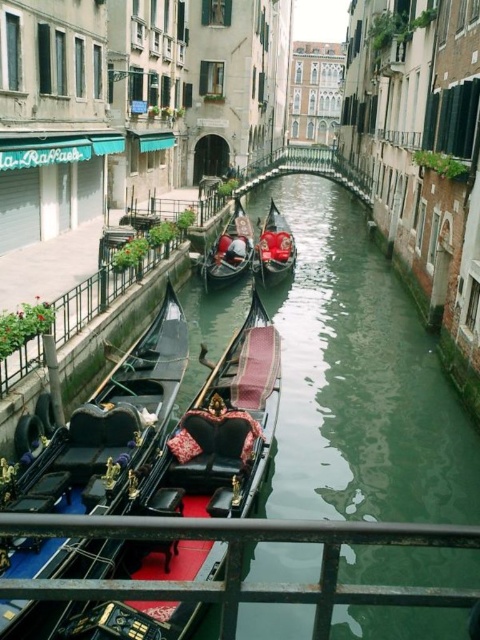
Does green smooth water at center appear over polished wood gondola at center?

Yes.

Who is shorter, green smooth water at center or polished wood gondola at center?

With less height is polished wood gondola at center.

Is point (436, 634) positioned after point (172, 394)?

No, it is not.

Locate an element on the screen. The width and height of the screenshot is (480, 640). green smooth water at center is located at coordinates (360, 380).

Is green smooth water at center positioned behind shiny black gondola at center?

No, green smooth water at center is closer to the viewer.

What do you see at coordinates (360, 380) in the screenshot? I see `green smooth water at center` at bounding box center [360, 380].

Who is more forward, (464, 417) or (239, 269)?

Positioned in front is point (464, 417).

The image size is (480, 640). I want to click on green smooth water at center, so click(360, 380).

Is point (6, 612) behind point (238, 269)?

No, it is not.

Who is more forward, (x=43, y=604) or (x=212, y=253)?

Point (x=43, y=604) is more forward.

Which is in front, point (61, 506) or point (219, 273)?

Positioned in front is point (61, 506).

Where is `polished wood gondola at center`? polished wood gondola at center is located at coordinates (112, 422).